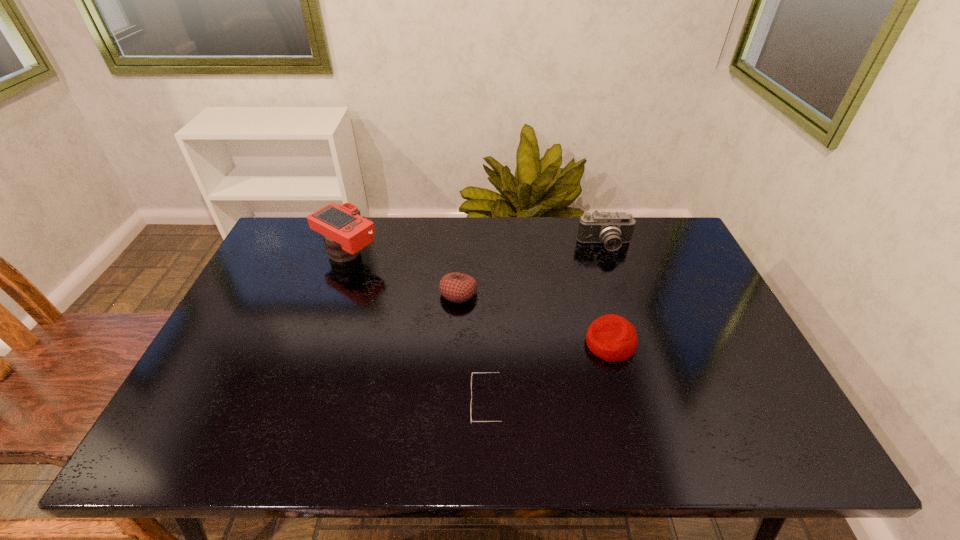
Find the location of a particular element. The image size is (960, 540). unoccupied area between the nearest object and the leftmost object is located at coordinates (422, 329).

Image resolution: width=960 pixels, height=540 pixels. Identify the location of blank region between the fourth farthest object and the sunglasses. (553, 374).

At what (x,y) coordinates should I click in order to perform the action: click on vacant region between the nearer beanbag and the fourth shortest object. Please return your answer as a coordinate pair (x, y). Looking at the image, I should click on (608, 295).

I want to click on free point between the right beanbag and the shortest object, so click(553, 374).

Where is `empty space that is in between the nearest object and the left beanbag`? empty space that is in between the nearest object and the left beanbag is located at coordinates (477, 348).

You are a GUI agent. You are given a task and a screenshot of the screen. Output one action in this format:
    pyautogui.click(x=<x>, y=<y>)
    Task: Click on the free area in between the nearest object and the third nearest object
    The image size is (960, 540).
    Given the screenshot: What is the action you would take?
    pyautogui.click(x=477, y=348)

The width and height of the screenshot is (960, 540). Find the location of `vacant space that is in between the nearest object and the nearer beanbag`. vacant space that is in between the nearest object and the nearer beanbag is located at coordinates (553, 374).

Image resolution: width=960 pixels, height=540 pixels. Identify the location of empty space that is in between the right camera and the nearer beanbag. (608, 295).

The image size is (960, 540). I want to click on object that stands as the second closest to the shortest object, so click(456, 287).

Identify which object is located as the second nearest to the farther beanbag. Please provide its 2D coordinates. Your answer should be formatted as a tuple, i.e. [(x, y)], where the tuple contains the x and y coordinates of a point satisfying the conditions above.

[(500, 372)]